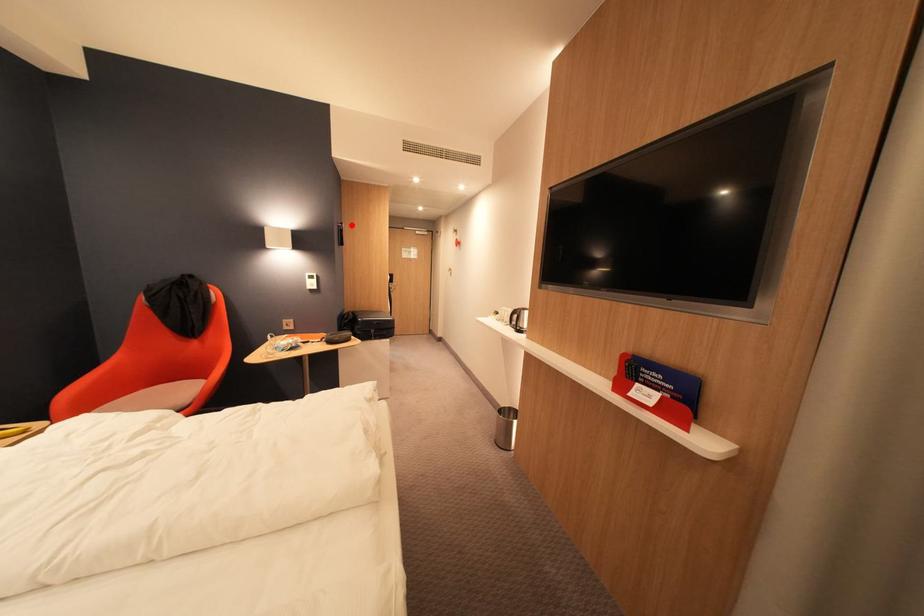
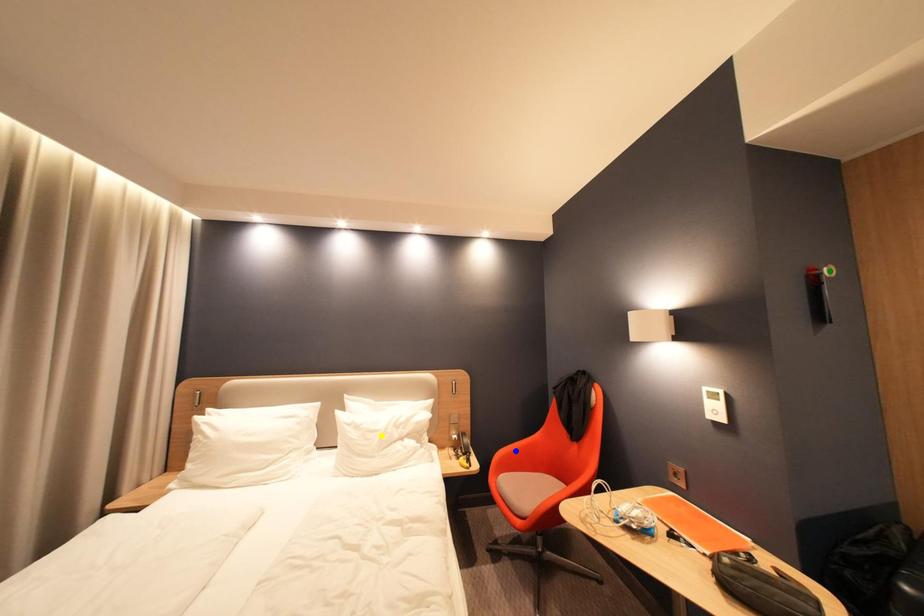
Question: I am providing you with two images of the same scene from different viewpoints. A red point is marked on the first image. You are given multiple points on the second image. Which point in image 2 is actually the same real-world point as the red point in image 1?

Choices:
 (A) blue point
 (B) yellow point
 (C) green point

Answer: (C)